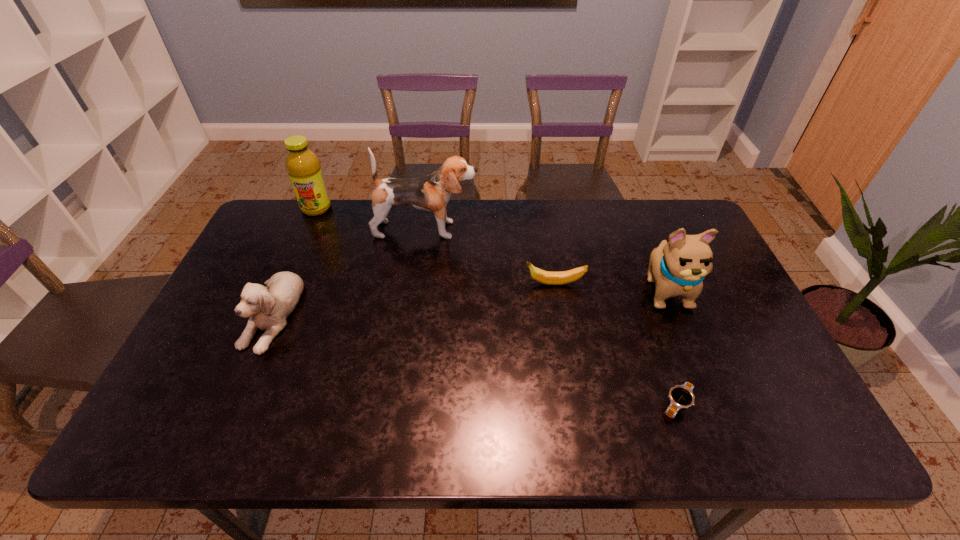
This screenshot has height=540, width=960. Find the location of `object that stands as the third closest to the fifth tallest object`. object that stands as the third closest to the fifth tallest object is located at coordinates (681, 396).

Select which object appears as the fourth closest to the leftmost puppy. Please provide its 2D coordinates. Your answer should be formatted as a tuple, i.e. [(x, y)], where the tuple contains the x and y coordinates of a point satisfying the conditions above.

[(681, 396)]

Find the location of a particular element. The width and height of the screenshot is (960, 540). puppy that is the second nearest to the second farthest object is located at coordinates (678, 268).

The width and height of the screenshot is (960, 540). I want to click on puppy that is the third closest to the banana, so click(268, 307).

At what (x,y) coordinates should I click in order to perform the action: click on free point that satisfies the following two spatial constraints: 1. on the front-facing side of the nearest object; 2. on the right side of the leftmost puppy. Please return your answer as a coordinate pair (x, y). Looking at the image, I should click on (232, 404).

Locate an element on the screen. The width and height of the screenshot is (960, 540). free space that satisfies the following two spatial constraints: 1. on the back side of the nearest object; 2. at the face of the farthest puppy is located at coordinates (616, 230).

Where is `vacant point that satisfies the following two spatial constraints: 1. on the front label of the nearest object; 2. on the left side of the farthest object`? vacant point that satisfies the following two spatial constraints: 1. on the front label of the nearest object; 2. on the left side of the farthest object is located at coordinates (230, 404).

Image resolution: width=960 pixels, height=540 pixels. I want to click on free spot that satisfies the following two spatial constraints: 1. at the face of the nearest object; 2. on the left side of the second farthest object, so click(401, 404).